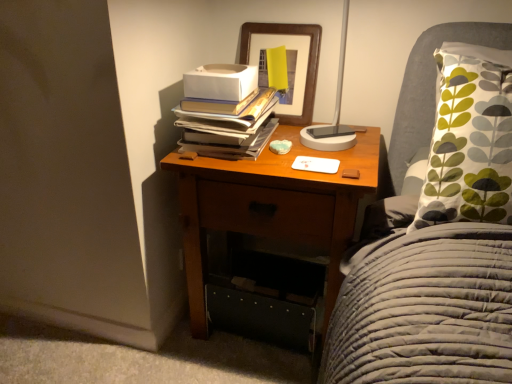
Question: Are wooden nightstand at center and wooden picture frame at upper center far apart?

Choices:
 (A) no
 (B) yes

Answer: (A)

Question: Is wooden picture frame at upper center completely or partially inside wooden nightstand at center?

Choices:
 (A) no
 (B) yes

Answer: (A)

Question: Can you confirm if wooden nightstand at center is smaller than wooden picture frame at upper center?

Choices:
 (A) yes
 (B) no

Answer: (B)

Question: Does wooden nightstand at center have a lesser height compared to wooden picture frame at upper center?

Choices:
 (A) yes
 (B) no

Answer: (B)

Question: Considering the relative positions of wooden nightstand at center and wooden picture frame at upper center in the image provided, is wooden nightstand at center to the left of wooden picture frame at upper center from the viewer's perspective?

Choices:
 (A) no
 (B) yes

Answer: (A)

Question: Considering the positions of wooden nightstand at center and wooden picture frame at upper center in the image, is wooden nightstand at center wider or thinner than wooden picture frame at upper center?

Choices:
 (A) thin
 (B) wide

Answer: (B)

Question: Is wooden nightstand at center to the left or to the right of wooden picture frame at upper center in the image?

Choices:
 (A) left
 (B) right

Answer: (B)

Question: Considering the positions of wooden nightstand at center and wooden picture frame at upper center in the image, is wooden nightstand at center bigger or smaller than wooden picture frame at upper center?

Choices:
 (A) big
 (B) small

Answer: (A)

Question: Relative to wooden picture frame at upper center, is wooden nightstand at center in front or behind?

Choices:
 (A) behind
 (B) front

Answer: (B)

Question: From the image's perspective, is wooden picture frame at upper center located above or below wooden nightstand at center?

Choices:
 (A) below
 (B) above

Answer: (B)

Question: Considering their positions, is wooden picture frame at upper center located in front of or behind wooden nightstand at center?

Choices:
 (A) front
 (B) behind

Answer: (B)

Question: Considering the relative positions of wooden picture frame at upper center and wooden nightstand at center in the image provided, is wooden picture frame at upper center to the left or to the right of wooden nightstand at center?

Choices:
 (A) right
 (B) left

Answer: (B)

Question: From a real-world perspective, is wooden picture frame at upper center positioned above or below wooden nightstand at center?

Choices:
 (A) below
 (B) above

Answer: (B)

Question: In terms of size, does wooden picture frame at upper center appear bigger or smaller than hardcover books at upper center?

Choices:
 (A) small
 (B) big

Answer: (B)

Question: In the image, is wooden picture frame at upper center on the left side or the right side of hardcover books at upper center?

Choices:
 (A) left
 (B) right

Answer: (B)